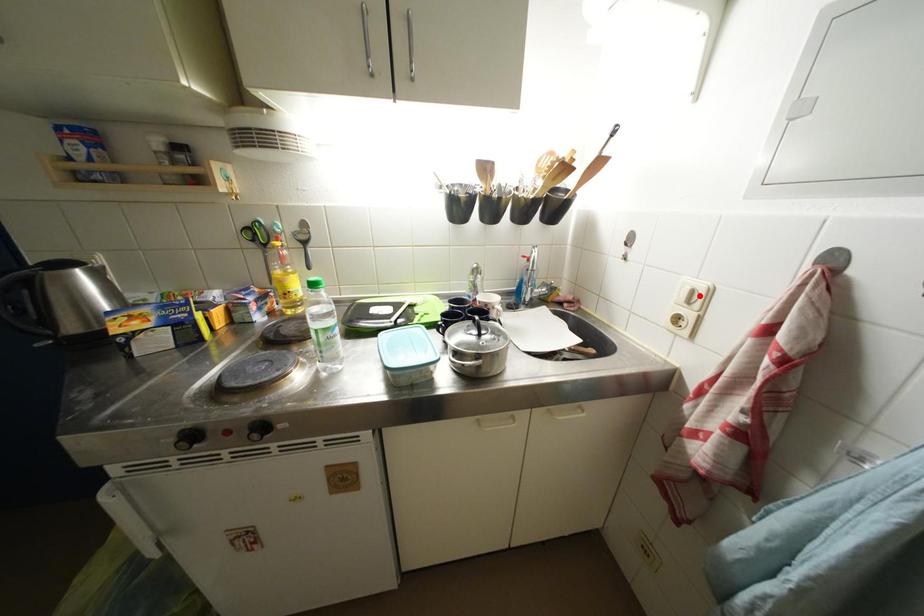
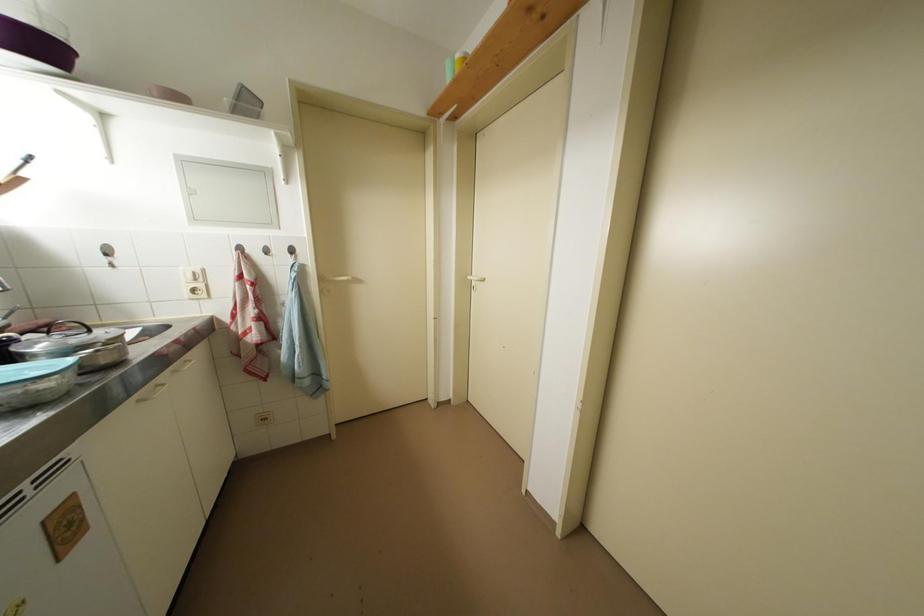
The point at the highlighted location is marked in the first image. Where is the corresponding point in the second image?

(201, 277)